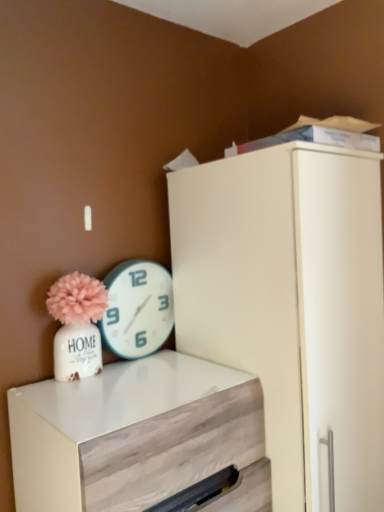
The image size is (384, 512). Identify the location of free point above white wood chest of drawers at lower left (from a real-world perspective). (129, 385).